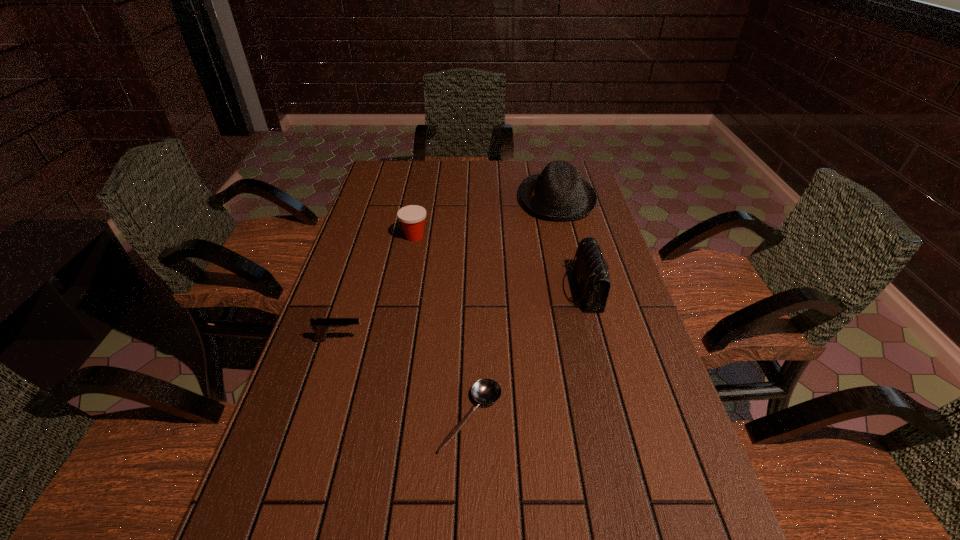
Locate an element on the screen. free space that satisfies the following two spatial constraints: 1. on the front flap of the third nearest object; 2. on the front side of the third object from left to right is located at coordinates (615, 417).

At what (x,y) coordinates should I click in order to perform the action: click on free space that satisfies the following two spatial constraints: 1. on the front side of the shortest object; 2. on the right side of the second farthest object. Please return your answer as a coordinate pair (x, y). This screenshot has width=960, height=540. Looking at the image, I should click on (380, 417).